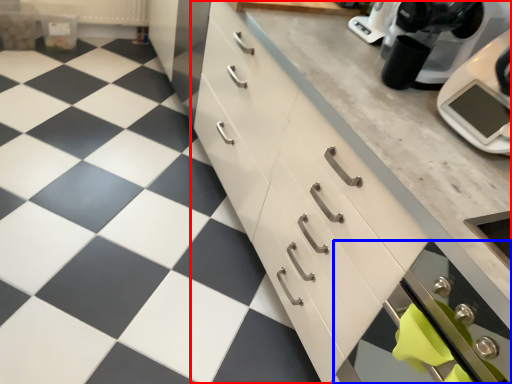
Question: Which object is closer to the camera taking this photo, cabinetry (highlighted by a red box) or oven (highlighted by a blue box)?

Choices:
 (A) cabinetry
 (B) oven

Answer: (A)